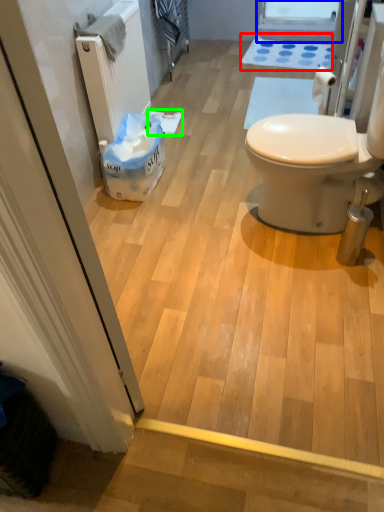
Question: Which object is the closest to the bath mat (highlighted by a red box)? Choose among these: window screen (highlighted by a blue box) or toilet paper (highlighted by a green box).

Choices:
 (A) window screen
 (B) toilet paper

Answer: (A)